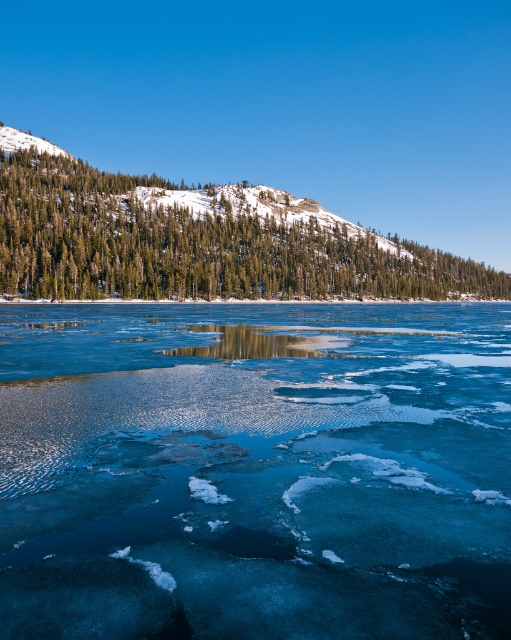
Question: Is translucent ice at center bigger than green textured pine trees at upper left?

Choices:
 (A) yes
 (B) no

Answer: (B)

Question: Which point is farther to the camera?

Choices:
 (A) (383, 289)
 (B) (394, 349)

Answer: (A)

Question: Is translucent ice at center thinner than green textured pine trees at upper left?

Choices:
 (A) yes
 (B) no

Answer: (A)

Question: Can you confirm if translucent ice at center is wider than green textured pine trees at upper left?

Choices:
 (A) yes
 (B) no

Answer: (B)

Question: Among these points, which one is nearest to the camera?

Choices:
 (A) (352, 243)
 (B) (502, 515)

Answer: (B)

Question: Which object is farther from the camera taking this photo?

Choices:
 (A) translucent ice at center
 (B) green textured pine trees at upper left

Answer: (B)